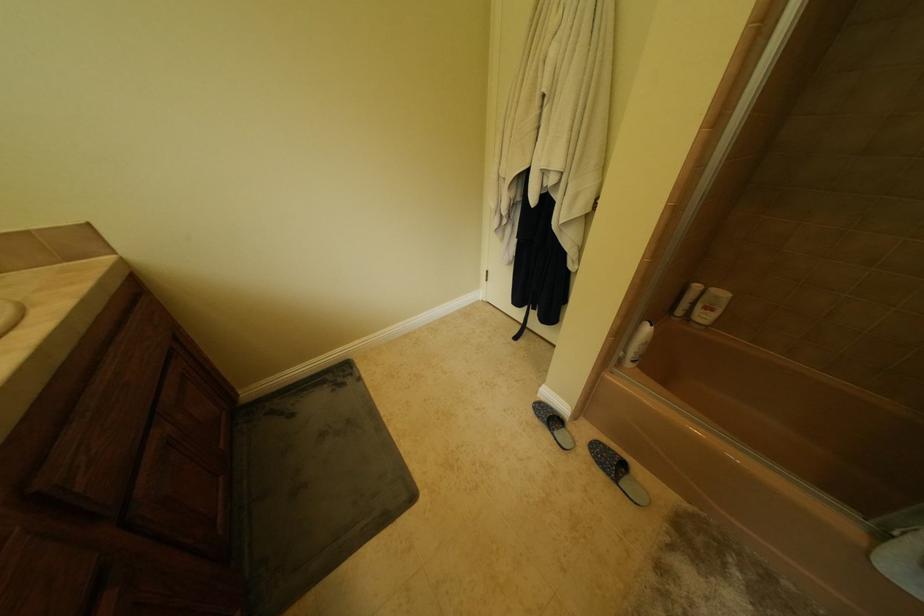
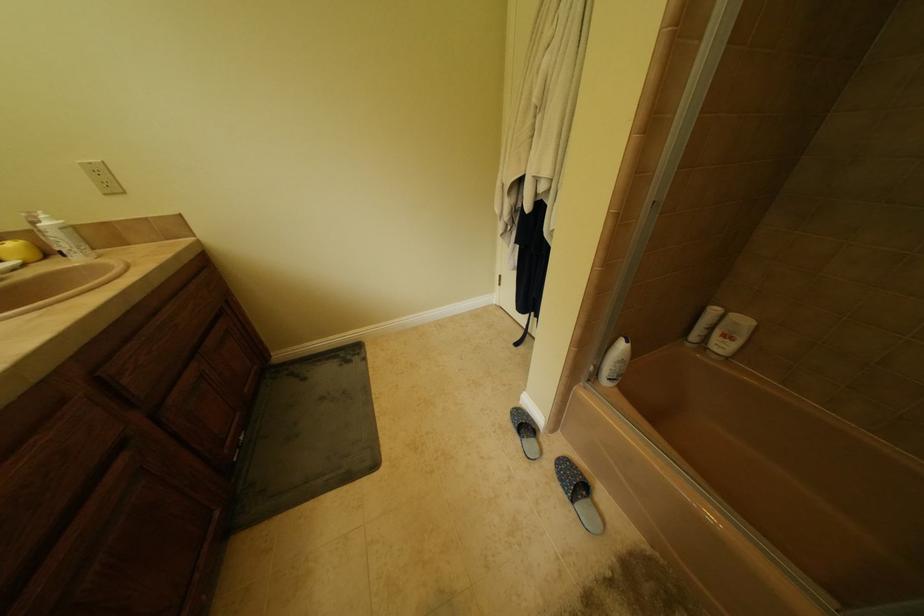
Question: The camera is either moving clockwise (left) or counter-clockwise (right) around the object. The first image is from the beginning of the video and the second image is from the end. Is the camera moving left or right when shooting the video?

Choices:
 (A) Left
 (B) Right

Answer: (B)